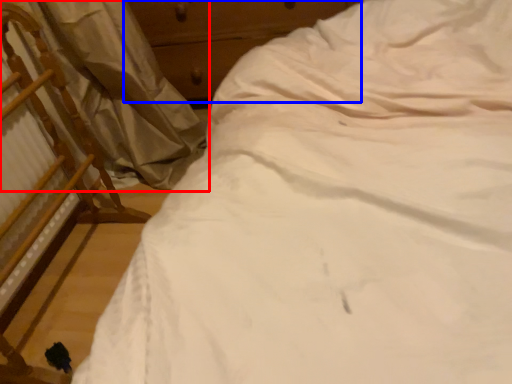
Question: Among these objects, which one is farthest to the camera, curtain (highlighted by a red box) or dresser (highlighted by a blue box)?

Choices:
 (A) curtain
 (B) dresser

Answer: (B)